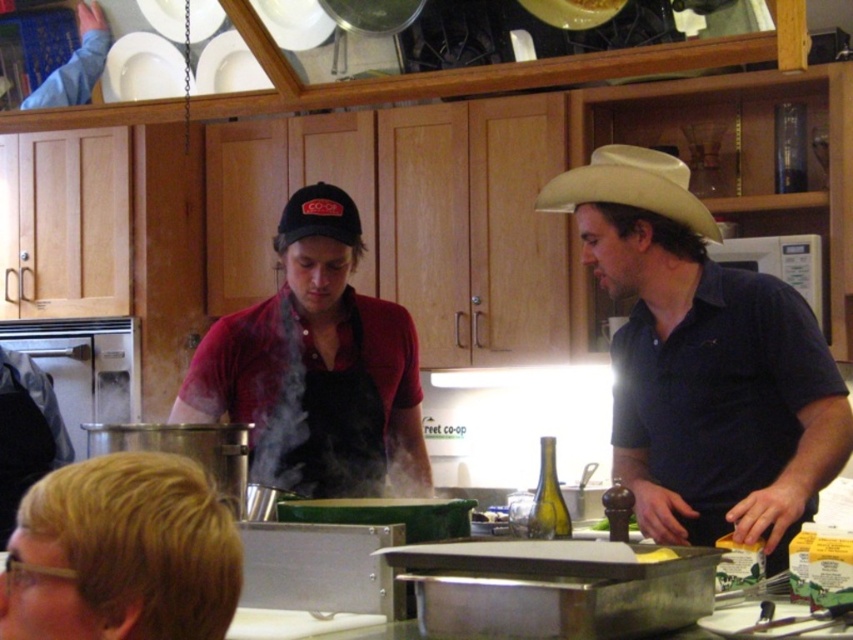
You are a chef trying to decide where to place a new spice rack between the dark blue shirt at center and the black fabric baseball cap at center. Based on their positions, which object should the spice rack be placed closer to?

The spice rack should be placed closer to the dark blue shirt at center because it is wider than the black fabric baseball cap at center, providing more space for the rack.

You are standing in the kitchen and want to grab the white matte plate at upper left. Considering your height is 1.7 meters, can you reach it without any assistance?

The white matte plate at upper left is 3.73 meters away from camera. Since the distance is greater than your height of 1.7 meters, you cannot reach it without assistance.

You are a chef trying to place a black fabric baseball cap at center on top of a white matte plate at upper left. Will the cap fit on the plate?

The white matte plate at upper left is larger in size than the black fabric baseball cap at center, so the cap will fit on the plate.